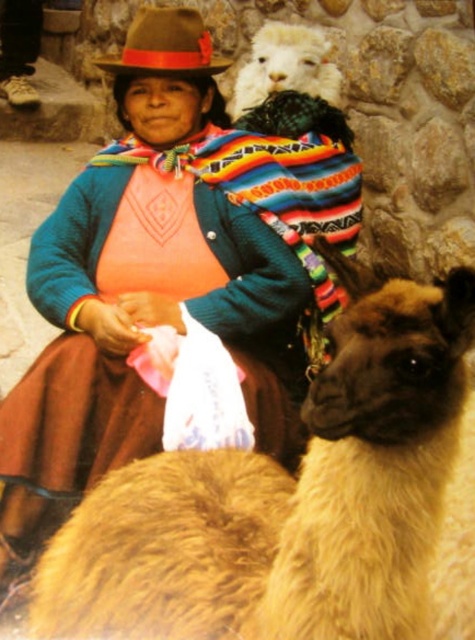
Which is more to the right, fuzzy beige alpaca at center or brown felt hat at upper center?

From the viewer's perspective, fuzzy beige alpaca at center appears more on the right side.

Is point (322, 472) less distant than point (174, 20)?

Yes.

Between point (420, 628) and point (190, 38), which one is positioned in front?

Positioned in front is point (420, 628).

Where is `fuzzy beige alpaca at center`? This screenshot has width=475, height=640. fuzzy beige alpaca at center is located at coordinates (286, 499).

Is fuzzy beige alpaca at center taller than white woolen alpaca at upper center?

Indeed, fuzzy beige alpaca at center has a greater height compared to white woolen alpaca at upper center.

Can you confirm if fuzzy beige alpaca at center is positioned to the right of white woolen alpaca at upper center?

Incorrect, fuzzy beige alpaca at center is not on the right side of white woolen alpaca at upper center.

This screenshot has width=475, height=640. Identify the location of fuzzy beige alpaca at center. (286, 499).

Does point (132, 100) come farther from viewer compared to point (151, 29)?

Yes, it is.

Between knitted wool sweater at center and brown felt hat at upper center, which one is positioned higher?

brown felt hat at upper center is higher up.

Which is in front, point (221, 336) or point (123, 44)?

Positioned in front is point (221, 336).

In order to click on knitted wool sweater at center in this screenshot , I will do `click(140, 332)`.